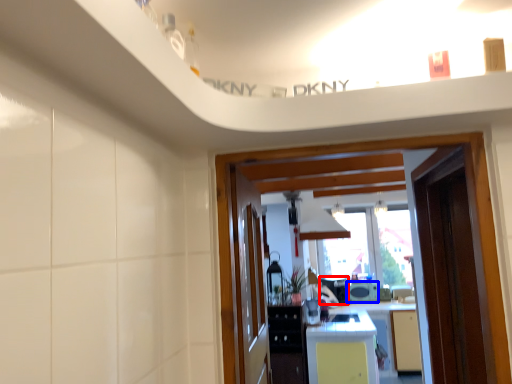
Question: Which point is closer to the camera, appliance (highlighted by a red box) or appliance (highlighted by a blue box)?

Choices:
 (A) appliance
 (B) appliance

Answer: (A)